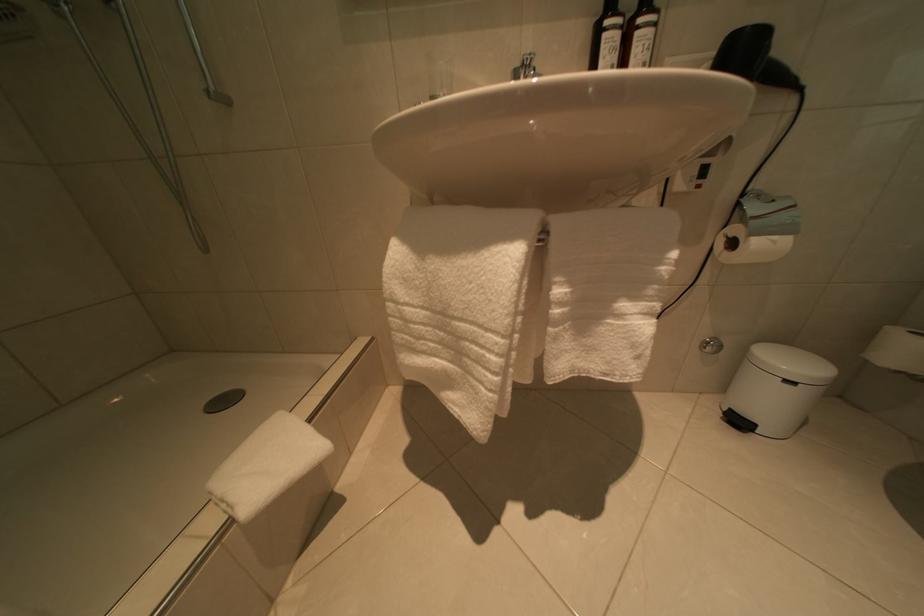
The image size is (924, 616). What do you see at coordinates (525, 68) in the screenshot?
I see `a faucet lever` at bounding box center [525, 68].